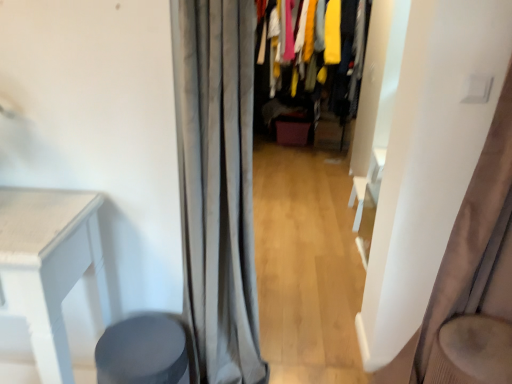
Question: Is point (449, 334) closer or farther from the camera than point (146, 327)?

Choices:
 (A) closer
 (B) farther

Answer: (A)

Question: From a real-world perspective, relative to matte gray stool at lower left, is velvet beige swivel chair at right vertically above or below?

Choices:
 (A) above
 (B) below

Answer: (A)

Question: Based on their relative distances, which object is farther from the velvet fabric clothes at center?

Choices:
 (A) matte gray stool at lower left
 (B) gray fabric curtain at center, which is the 2th curtain in right-to-left order
 (C) velvet beige swivel chair at right
 (D) satin beige curtain at right, arranged as the 2th curtain when viewed from the left

Answer: (A)

Question: Considering the real-world distances, which object is closest to the matte gray stool at lower left?

Choices:
 (A) gray fabric curtain at center, which is the 2th curtain in right-to-left order
 (B) velvet fabric clothes at center
 (C) satin beige curtain at right, arranged as the 2th curtain when viewed from the left
 (D) velvet beige swivel chair at right

Answer: (A)